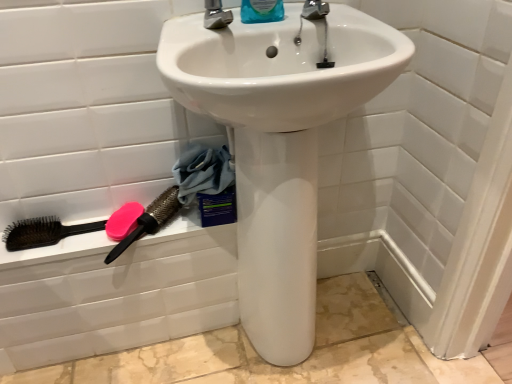
Question: From the image's perspective, is blue plastic bottle at upper center above or below white glossy sink at center?

Choices:
 (A) above
 (B) below

Answer: (A)

Question: From their relative heights in the image, would you say blue plastic bottle at upper center is taller or shorter than white glossy sink at center?

Choices:
 (A) short
 (B) tall

Answer: (A)

Question: Which of these objects is positioned closest to the white glossy sink at center?

Choices:
 (A) pink rubber brush at lower left, which appears as the 1th brush when viewed from the right
 (B) pink matte soap at lower left
 (C) metallic silver faucet at upper center
 (D) blue fabric at lower left
 (E) black plastic brush at lower left, which appears as the second brush when viewed from the right

Answer: (D)

Question: Based on their relative distances, which object is farther from the brown bristle brush at lower left, which is counted as the third brush, starting from the right?

Choices:
 (A) white glossy sink at center
 (B) blue fabric at lower left
 (C) black plastic brush at lower left, the 2th brush viewed from the left
 (D) pink matte soap at lower left
 (E) metallic silver faucet at upper center

Answer: (E)